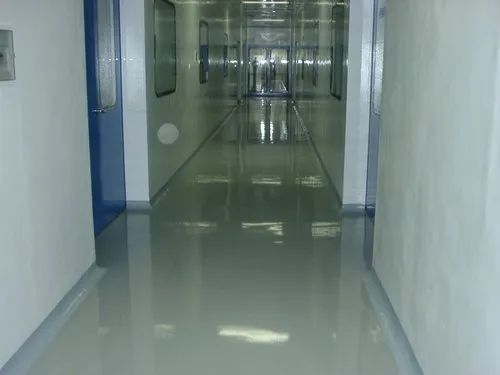
Locate an element on the screen. ceilings is located at coordinates (270, 10), (270, 143).